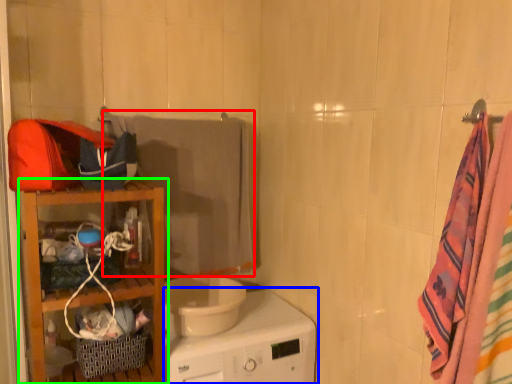
Question: Based on their relative distances, which object is farther from beach towel (highlighted by a red box)? Choose from home appliance (highlighted by a blue box) and furniture (highlighted by a green box).

Choices:
 (A) home appliance
 (B) furniture

Answer: (A)